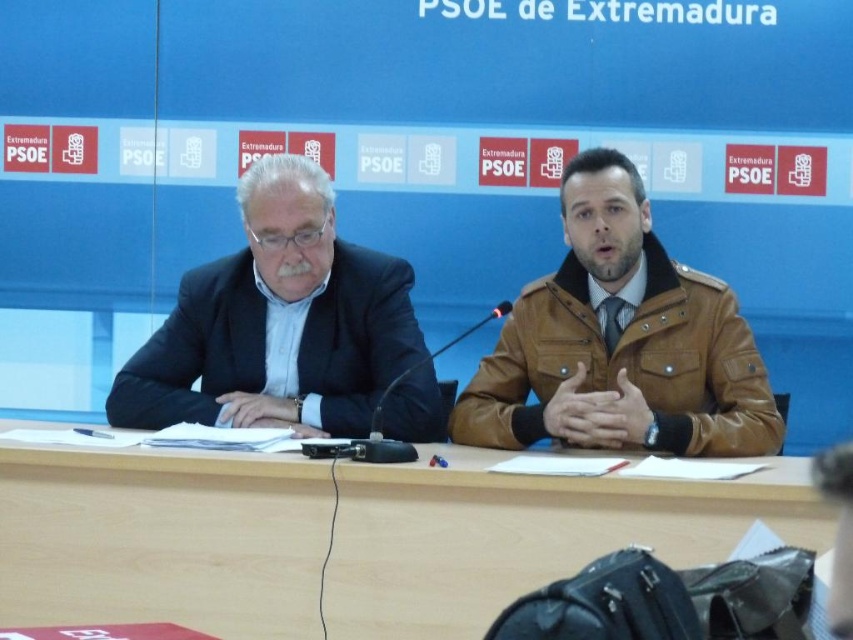
Question: Which of these objects is positioned closest to the matte black suit at left?

Choices:
 (A) wooden table at center
 (B) brown leather jacket at center

Answer: (A)

Question: Which point appears closest to the camera in this image?

Choices:
 (A) coord(711,321)
 (B) coord(247,371)
 (C) coord(61,476)

Answer: (C)

Question: Which point is closer to the camera taking this photo?

Choices:
 (A) (613, 397)
 (B) (260, 346)

Answer: (A)

Question: Observing the image, what is the correct spatial positioning of brown leather jacket at center in reference to matte black suit at left?

Choices:
 (A) left
 (B) right

Answer: (B)

Question: Can you confirm if wooden table at center is bigger than brown leather jacket at center?

Choices:
 (A) no
 (B) yes

Answer: (B)

Question: Can you confirm if wooden table at center is positioned to the left of matte black suit at left?

Choices:
 (A) yes
 (B) no

Answer: (B)